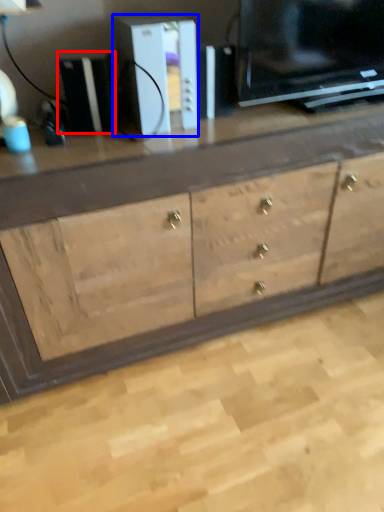
Question: Which of the following is the farthest to the observer, appliance (highlighted by a red box) or appliance (highlighted by a blue box)?

Choices:
 (A) appliance
 (B) appliance

Answer: (A)